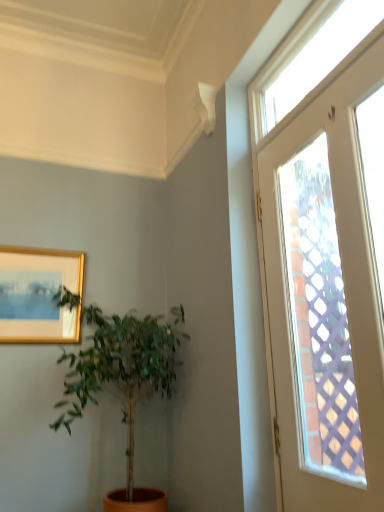
Image resolution: width=384 pixels, height=512 pixels. I want to click on clear glass window at upper right, which is the first window in top-to-bottom order, so (x=310, y=56).

The image size is (384, 512). Identify the location of gold-framed picture at upper left. (39, 295).

This screenshot has width=384, height=512. What are the coordinates of `window that is the 2nd one when counting forward from the gold-framed picture at upper left` in the screenshot? It's located at (306, 294).

Which object is closer to the camera, clear glass door at upper right, the second window positioned from the top, or gold-framed picture at upper left?

clear glass door at upper right, the second window positioned from the top, is more forward.

Which is more to the left, clear glass door at upper right, the second window positioned from the top, or gold-framed picture at upper left?

gold-framed picture at upper left.

Does clear glass door at upper right, the second window positioned from the top, have a lesser height compared to gold-framed picture at upper left?

No, clear glass door at upper right, the second window positioned from the top, is not shorter than gold-framed picture at upper left.

Is clear glass door at upper right, the second window positioned from the top, located within gold-framed picture at upper left?

No, clear glass door at upper right, the second window positioned from the top, is not a part of gold-framed picture at upper left.

From a real-world perspective, which is physically below, gold-framed picture at upper left or clear glass door at upper right, acting as the first window starting from the bottom?

In real-world perspective, clear glass door at upper right, acting as the first window starting from the bottom, is lower.

Considering the points (62, 274) and (373, 309), which point is in front, point (62, 274) or point (373, 309)?

The point (373, 309) is in front.

From the image's perspective, does gold-framed picture at upper left appear lower than clear glass door at upper right, the second window positioned from the top?

Correct, gold-framed picture at upper left appears lower than clear glass door at upper right, the second window positioned from the top, in the image.

Is gold-framed picture at upper left located within green leafy plant at left?

No, green leafy plant at left does not contain gold-framed picture at upper left.

What's the angular difference between green leafy plant at left and gold-framed picture at upper left's facing directions?

They differ by 0.199 degrees in their facing directions.

Is green leafy plant at left looking in the opposite direction of gold-framed picture at upper left?

That's not correct — green leafy plant at left is not looking away from gold-framed picture at upper left.

Would you consider green leafy plant at left to be distant from gold-framed picture at upper left?

No, there isn't a large distance between green leafy plant at left and gold-framed picture at upper left.

Is green leafy plant at left at the back of gold-framed picture at upper left?

No, gold-framed picture at upper left's orientation is not away from green leafy plant at left.

Is gold-framed picture at upper left wider or thinner than green leafy plant at left?

Considering their sizes, gold-framed picture at upper left looks slimmer than green leafy plant at left.

Considering the relative sizes of gold-framed picture at upper left and green leafy plant at left in the image provided, is gold-framed picture at upper left taller than green leafy plant at left?

In fact, gold-framed picture at upper left may be shorter than green leafy plant at left.

Consider the image. Considering the sizes of objects gold-framed picture at upper left and green leafy plant at left in the image provided, who is bigger, gold-framed picture at upper left or green leafy plant at left?

green leafy plant at left.

Which object is closer to the camera taking this photo, green leafy plant at left or clear glass door at upper right, the second window positioned from the top?

Positioned in front is clear glass door at upper right, the second window positioned from the top.

Considering the points (149, 368) and (355, 75), which point is in front, point (149, 368) or point (355, 75)?

The point (355, 75) is more forward.

Is green leafy plant at left with clear glass door at upper right, the second window positioned from the top?

No, green leafy plant at left is not beside clear glass door at upper right, the second window positioned from the top.

In the scene shown: Could you measure the distance between green leafy plant at left and clear glass door at upper right, the second window positioned from the top?

green leafy plant at left and clear glass door at upper right, the second window positioned from the top, are 29.03 inches apart from each other.

From the image's perspective, which is above, green leafy plant at left or clear glass window at upper right, which is the first window in top-to-bottom order?

From the image's view, clear glass window at upper right, which is the first window in top-to-bottom order, is above.

Is green leafy plant at left in front of clear glass window at upper right, the second window when ordered from bottom to top?

No.

Is green leafy plant at left shorter than clear glass window at upper right, the second window when ordered from bottom to top?

No, green leafy plant at left is not shorter than clear glass window at upper right, the second window when ordered from bottom to top.

Is green leafy plant at left to the left of clear glass window at upper right, the second window when ordered from bottom to top, from the viewer's perspective?

Yes.

In terms of size, does clear glass window at upper right, which is the first window in top-to-bottom order, appear bigger or smaller than clear glass door at upper right, acting as the first window starting from the bottom?

clear glass window at upper right, which is the first window in top-to-bottom order, is smaller than clear glass door at upper right, acting as the first window starting from the bottom.

What's the angular difference between clear glass window at upper right, the second window when ordered from bottom to top, and clear glass door at upper right, the second window positioned from the top,'s facing directions?

The angular difference between clear glass window at upper right, the second window when ordered from bottom to top, and clear glass door at upper right, the second window positioned from the top, is 0.648 degrees.

Between clear glass window at upper right, which is the first window in top-to-bottom order, and clear glass door at upper right, the second window positioned from the top, which one has smaller width?

clear glass door at upper right, the second window positioned from the top.

From a real-world perspective, which object rests below the other?

clear glass door at upper right, the second window positioned from the top, is physically lower.

I want to click on window below the gold-framed picture at upper left (from a real-world perspective), so click(306, 294).

In the image, there is a clear glass door at upper right, the second window positioned from the top. Identify the location of picture frame below it (from the image's perspective). The height and width of the screenshot is (512, 384). (39, 295).

From the image, which object appears to be farther from clear glass window at upper right, which is the first window in top-to-bottom order, gold-framed picture at upper left or green leafy plant at left?

gold-framed picture at upper left is positioned further to the anchor clear glass window at upper right, which is the first window in top-to-bottom order.

When comparing their distances from green leafy plant at left, does clear glass window at upper right, the second window when ordered from bottom to top, or gold-framed picture at upper left seem closer?

gold-framed picture at upper left.

When comparing their distances from gold-framed picture at upper left, does clear glass window at upper right, which is the first window in top-to-bottom order, or green leafy plant at left seem closer?

The object closer to gold-framed picture at upper left is green leafy plant at left.

Based on their spatial positions, is green leafy plant at left or gold-framed picture at upper left closer to clear glass door at upper right, the second window positioned from the top?

green leafy plant at left is closer to clear glass door at upper right, the second window positioned from the top.

Considering their positions, is clear glass door at upper right, the second window positioned from the top, positioned further to green leafy plant at left than clear glass window at upper right, which is the first window in top-to-bottom order?

clear glass window at upper right, which is the first window in top-to-bottom order, is further to green leafy plant at left.

Which object lies further to the anchor point clear glass window at upper right, the second window when ordered from bottom to top, green leafy plant at left or gold-framed picture at upper left?

gold-framed picture at upper left.

In the scene shown: Which object lies further to the anchor point green leafy plant at left, clear glass window at upper right, which is the first window in top-to-bottom order, or clear glass door at upper right, the second window positioned from the top?

A: clear glass window at upper right, which is the first window in top-to-bottom order, lies further to green leafy plant at left than the other object.

Considering their positions, is gold-framed picture at upper left positioned further to clear glass window at upper right, the second window when ordered from bottom to top, than clear glass door at upper right, the second window positioned from the top?

Based on the image, gold-framed picture at upper left appears to be further to clear glass window at upper right, the second window when ordered from bottom to top.

What are the coordinates of `window located between gold-framed picture at upper left and clear glass door at upper right, the second window positioned from the top, in the left-right direction` in the screenshot? It's located at (310, 56).

This screenshot has height=512, width=384. Identify the location of window between clear glass window at upper right, which is the first window in top-to-bottom order, and green leafy plant at left from top to bottom. (306, 294).

Identify the location of houseplant situated between gold-framed picture at upper left and clear glass door at upper right, the second window positioned from the top, from left to right. Image resolution: width=384 pixels, height=512 pixels. (123, 368).

Identify the location of picture frame between clear glass window at upper right, the second window when ordered from bottom to top, and green leafy plant at left vertically. The height and width of the screenshot is (512, 384). (39, 295).